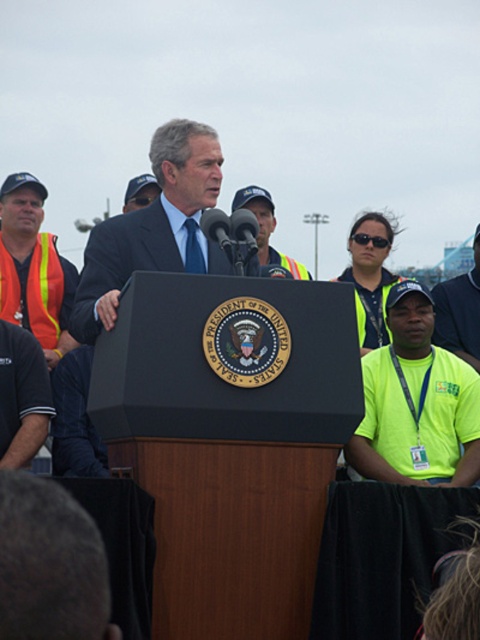
Question: Which of the following is the closest to the observer?

Choices:
 (A) (206, 131)
 (B) (40, 285)

Answer: (A)

Question: Considering the relative positions of blue suit at center and orange reflective safety vest at left in the image provided, where is blue suit at center located with respect to orange reflective safety vest at left?

Choices:
 (A) above
 (B) below

Answer: (B)

Question: Does blue suit at center appear on the left side of orange reflective safety vest at left?

Choices:
 (A) yes
 (B) no

Answer: (B)

Question: Can you confirm if blue suit at center is wider than orange reflective safety vest at left?

Choices:
 (A) yes
 (B) no

Answer: (A)

Question: Among these objects, which one is nearest to the camera?

Choices:
 (A) blue suit at center
 (B) orange reflective safety vest at left

Answer: (A)